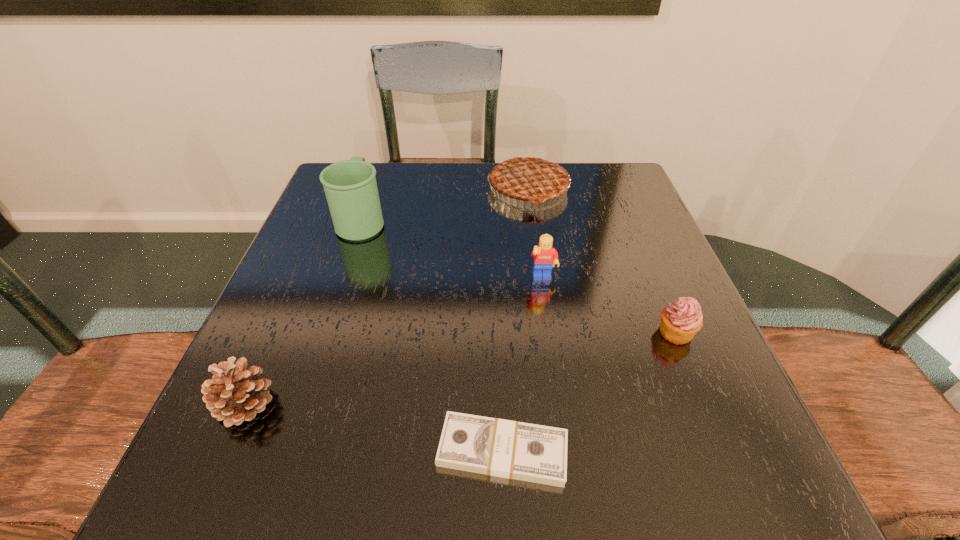
You are a GUI agent. You are given a task and a screenshot of the screen. Output one action in this format:
    pyautogui.click(x=<x>, y=<y>)
    Task: Click on the pie
    The height and width of the screenshot is (540, 960).
    Given the screenshot: What is the action you would take?
    pyautogui.click(x=531, y=178)

The image size is (960, 540). I want to click on mug, so [350, 186].

Where is `the third farthest object`? Image resolution: width=960 pixels, height=540 pixels. the third farthest object is located at coordinates (545, 256).

Find the location of a particular element. This screenshot has width=960, height=540. pinecone is located at coordinates (235, 394).

Find the location of `cupcake`. cupcake is located at coordinates (681, 320).

Image resolution: width=960 pixels, height=540 pixels. Find the location of `the second shortest object`. the second shortest object is located at coordinates (681, 320).

You are a GUI agent. You are given a task and a screenshot of the screen. Output one action in this format:
    pyautogui.click(x=<x>, y=<y>)
    Task: Click on the dollar
    The image size is (960, 540).
    Given the screenshot: What is the action you would take?
    pyautogui.click(x=503, y=448)

Locate an element on the screen. This screenshot has height=540, width=960. free point located on the front of the pie is located at coordinates (551, 340).

In order to click on free space located 0.180m on the side of the mug with the handle in this screenshot , I will do `click(381, 164)`.

You are a GUI agent. You are given a task and a screenshot of the screen. Output one action in this format:
    pyautogui.click(x=<x>, y=<y>)
    Task: Click on the vacant space situated 0.050m on the side of the mug with the handle
    
    Given the screenshot: What is the action you would take?
    pyautogui.click(x=372, y=189)